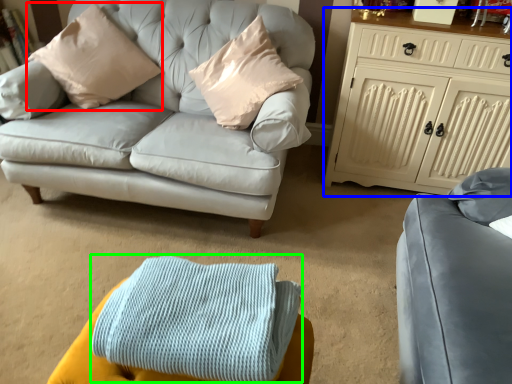
Question: Which is farther away from pillow (highlighted by a red box)? cabinetry (highlighted by a blue box) or blanket (highlighted by a green box)?

Choices:
 (A) cabinetry
 (B) blanket

Answer: (B)